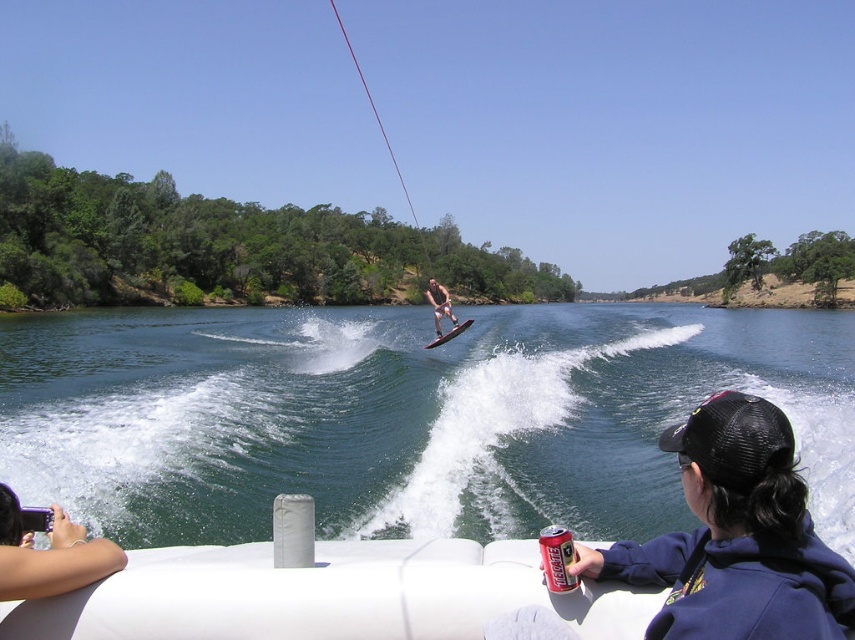
You are a photographer on the boat and want to capture a photo of the water skier. Based on the scene, which object is positioned lower in the frame between the clear water at wake center and the smooth tan skin at center?

The clear water at wake center is positioned below the smooth tan skin at center, so the clear water at wake center is lower in the frame.

You are a safety officer assessing the water skiing scene. You notice the clear water at wake center and the skinny jeans at lower left. Which object is higher in the scene?

The clear water at wake center is much taller than the skinny jeans at lower left.